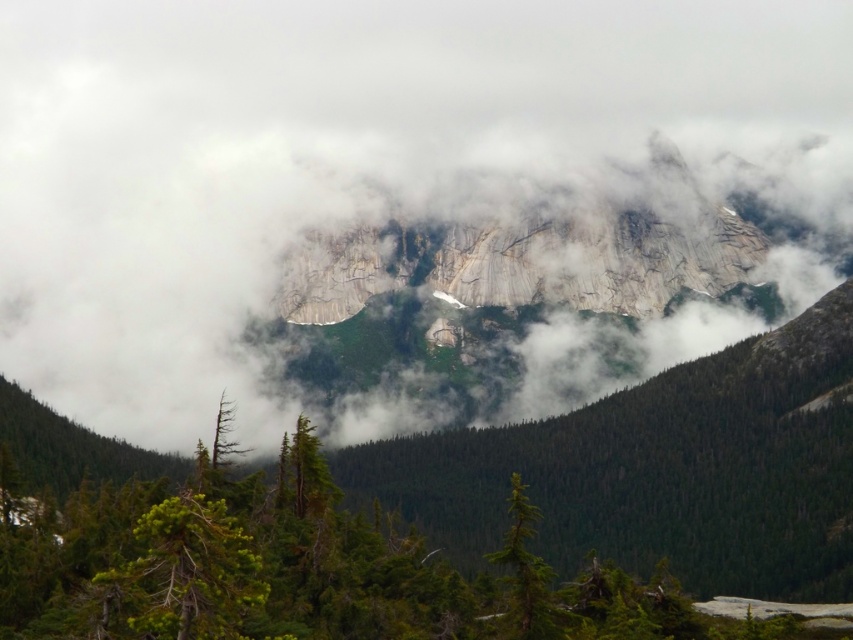
Question: Which of the following is the closest to the observer?

Choices:
 (A) green matte tree at lower left
 (B) white fluffy cloud at center
 (C) needle-like evergreen at lower left
 (D) green matte tree at lower right

Answer: (A)

Question: Considering the real-world distances, which object is farthest from the green matte tree at lower right?

Choices:
 (A) needle-like evergreen at lower left
 (B) white fluffy cloud at center
 (C) green matte tree at lower left

Answer: (B)

Question: Does green matte tree at lower left appear under green matte tree at lower right?

Choices:
 (A) no
 (B) yes

Answer: (A)

Question: Which point is closer to the camera?

Choices:
 (A) green matte tree at lower left
 (B) needle-like evergreen at lower left

Answer: (A)

Question: Can you confirm if green matte tree at lower right is positioned above needle-like evergreen at lower left?

Choices:
 (A) no
 (B) yes

Answer: (A)

Question: Is green matte tree at lower right wider than needle-like evergreen at lower left?

Choices:
 (A) no
 (B) yes

Answer: (A)